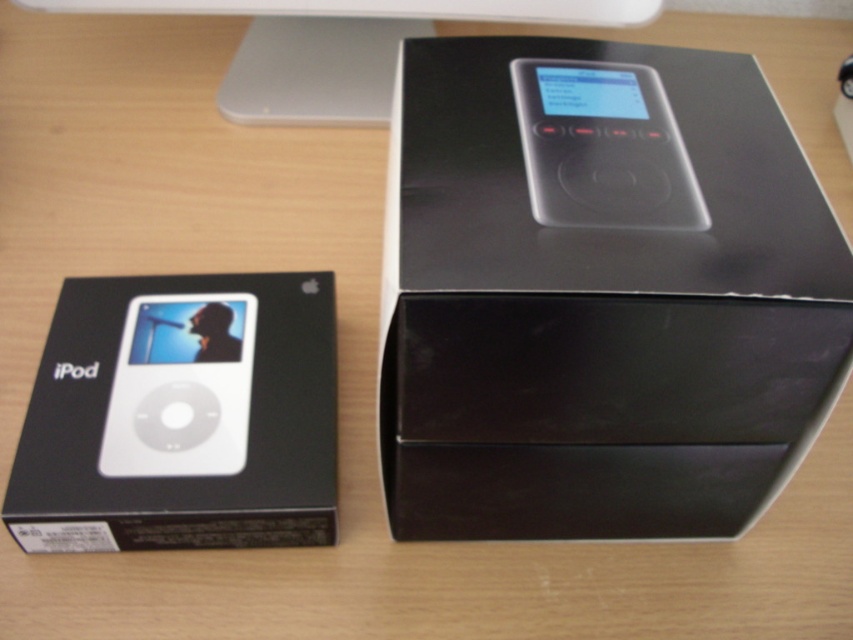
You are organizing a display for electronic gadgets and need to place the white matte ipod at center and the satin black ipod at center on a shelf. Based on their positions in the image, which iPod should you place lower on the shelf?

The white matte ipod at center should be placed lower on the shelf because it is located below the satin black ipod at center in the image.

You are setting up a small desk in your room and have both the white matte ipod at center and the white plastic desktop computer at upper center. Which item takes up more horizontal space on the desk?

The white plastic desktop computer at upper center takes up more horizontal space on the desk because it has a greater width than the white matte ipod at center.